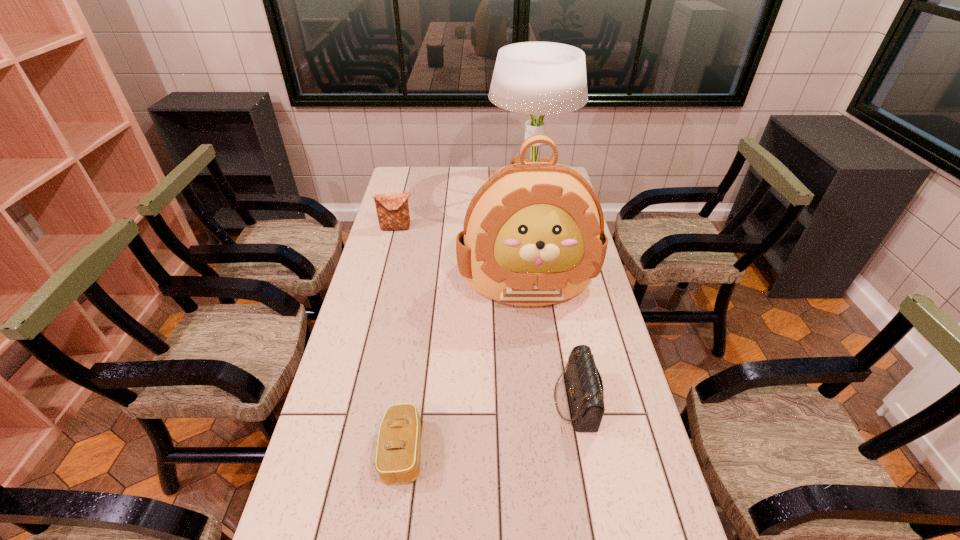
Where is `lamp`? The height and width of the screenshot is (540, 960). lamp is located at coordinates (536, 78).

Where is `backpack`? This screenshot has width=960, height=540. backpack is located at coordinates (533, 235).

Where is `the tallest clutch bag`? the tallest clutch bag is located at coordinates (392, 209).

I want to click on the leftmost clutch bag, so click(392, 209).

This screenshot has height=540, width=960. I want to click on the second shortest clutch bag, so click(x=585, y=386).

This screenshot has height=540, width=960. I want to click on the rightmost clutch bag, so click(585, 386).

In order to click on the shortest clutch bag in this screenshot , I will do `click(398, 453)`.

Locate an element on the screen. the second clutch bag from right to left is located at coordinates pos(398,453).

I want to click on vacant space located on the front-facing side of the farthest object, so click(404, 193).

Where is `free space located 0.400m on the front-facing side of the farthest object`? The width and height of the screenshot is (960, 540). free space located 0.400m on the front-facing side of the farthest object is located at coordinates (397, 193).